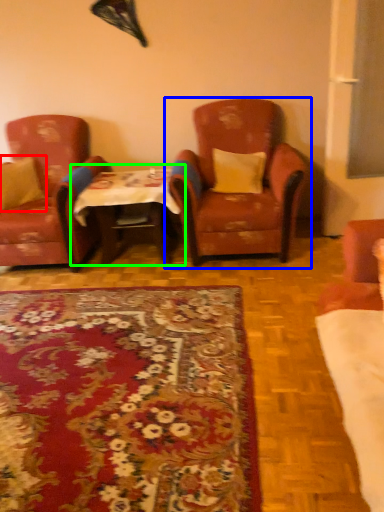
Question: Which object is the closest to the pillow (highlighted by a red box)? Choose among these: chair (highlighted by a blue box) or table (highlighted by a green box).

Choices:
 (A) chair
 (B) table

Answer: (B)